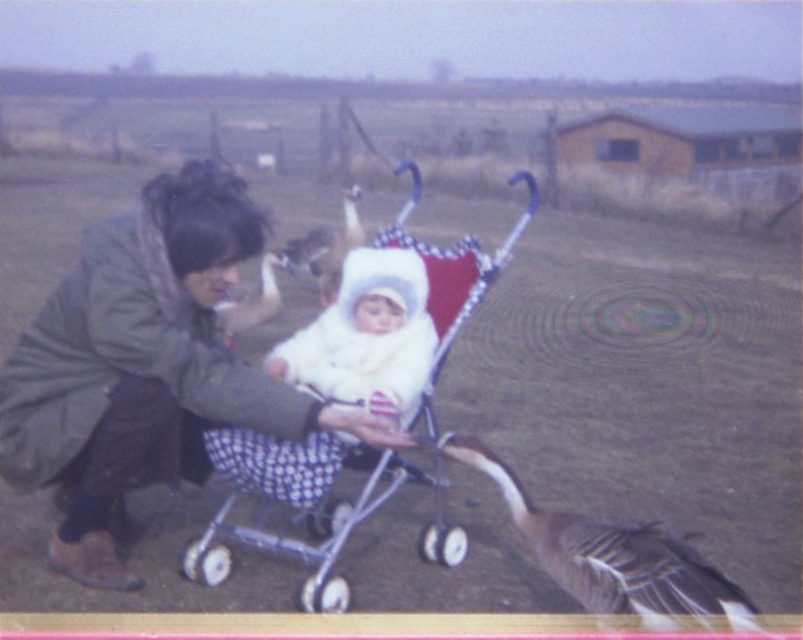
You are standing at the center of the image and want to place a new decorative item exactly where the polka dot fabric baby carriage at center is currently located. According to the coordinates provided, what are the coordinates where you should place the new item?

The coordinates for the polka dot fabric baby carriage at center are at point (x=394, y=317), so you should place the new decorative item at those exact coordinates.

In the scene shown: You are a photographer aiming to capture a closeup of the gray feathered goose at lower right without including the green fuzzy coat at center in the frame. Is this possible given their positions?

The green fuzzy coat at center is located above the gray feathered goose at lower right, so if you position your camera to focus on the goose at lower right and angle it to avoid the area above, it should be possible to capture the goose without the coat in the frame.